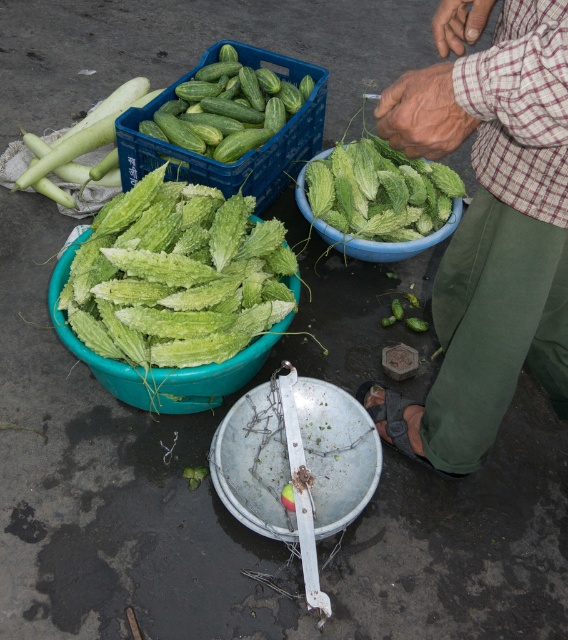
Question: Which object is farther from the camera taking this photo?

Choices:
 (A) green leafy vegetable at center
 (B) smooth white cucumber at upper left

Answer: (B)

Question: Is green matte cucumbers at upper left smaller than smooth white cucumber at upper left?

Choices:
 (A) yes
 (B) no

Answer: (B)

Question: Considering the real-world distances, which object is farthest from the green leafy vegetable at center?

Choices:
 (A) green leafy bowl at center
 (B) smooth white cucumber at upper left

Answer: (B)

Question: Is green plaid shirt at upper right closer to the viewer compared to green leafy vegetable at center?

Choices:
 (A) no
 (B) yes

Answer: (B)

Question: Which point appears farthest from the camera in this image?

Choices:
 (A) (220, 284)
 (B) (133, 81)

Answer: (B)

Question: Does green plaid shirt at upper right appear on the right side of green leafy vegetable at center?

Choices:
 (A) yes
 (B) no

Answer: (A)